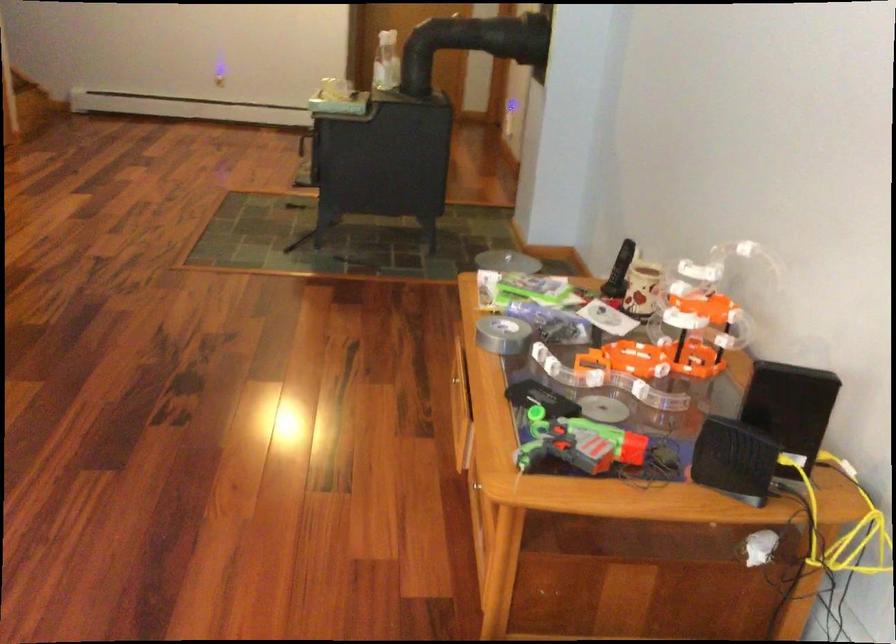
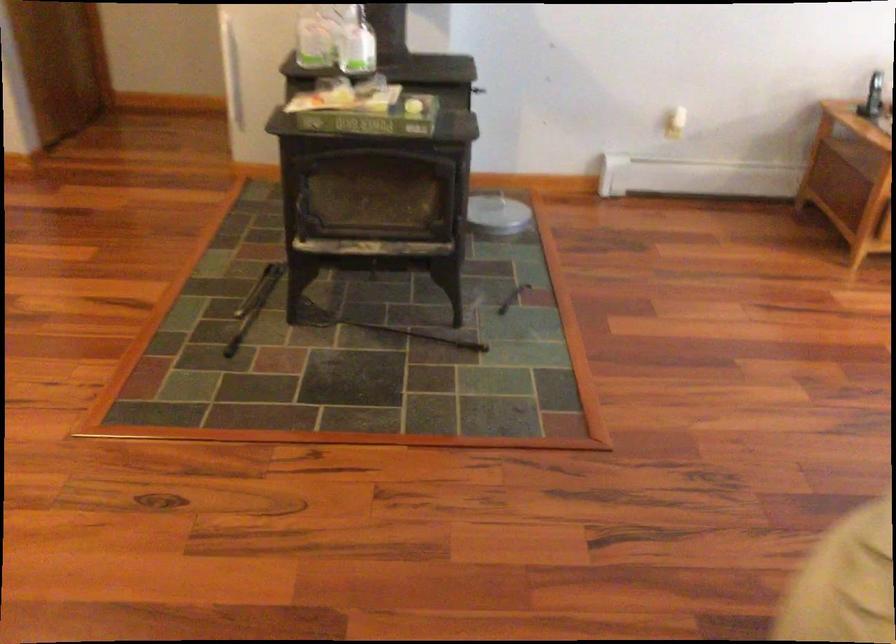
Locate, in the second image, the point that corresponds to pixel 309 231 in the first image.

(380, 327)